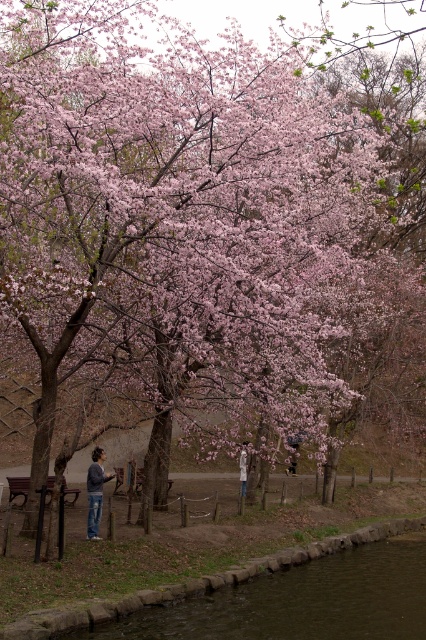
Question: Where is wooden bench at lower left located in relation to light brown leather jacket at center in the image?

Choices:
 (A) below
 (B) above

Answer: (B)

Question: Does denim jeans at center lie behind light brown leather jacket at center?

Choices:
 (A) yes
 (B) no

Answer: (B)

Question: Which point is farther to the camera?

Choices:
 (A) wooden park bench at center
 (B) denim jeans at center

Answer: (A)

Question: Which point appears farthest from the camera in this image?

Choices:
 (A) (138, 474)
 (B) (6, 476)
 (C) (247, 456)
 (D) (100, 481)

Answer: (C)

Question: Does wooden bench at lower left have a smaller size compared to light brown leather jacket at center?

Choices:
 (A) yes
 (B) no

Answer: (B)

Question: Which of the following is the farthest from the observer?

Choices:
 (A) (241, 486)
 (B) (14, 476)
 (C) (249, 605)

Answer: (A)